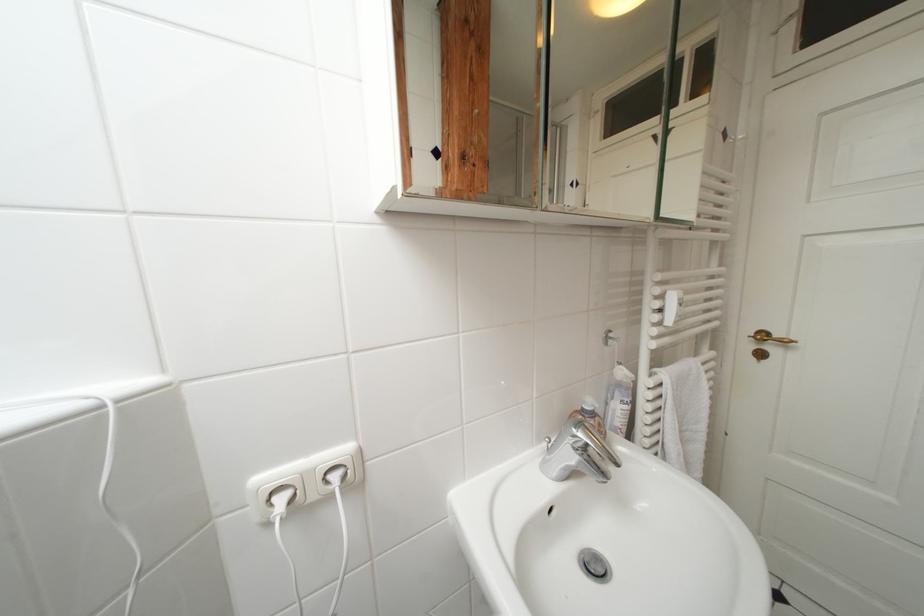
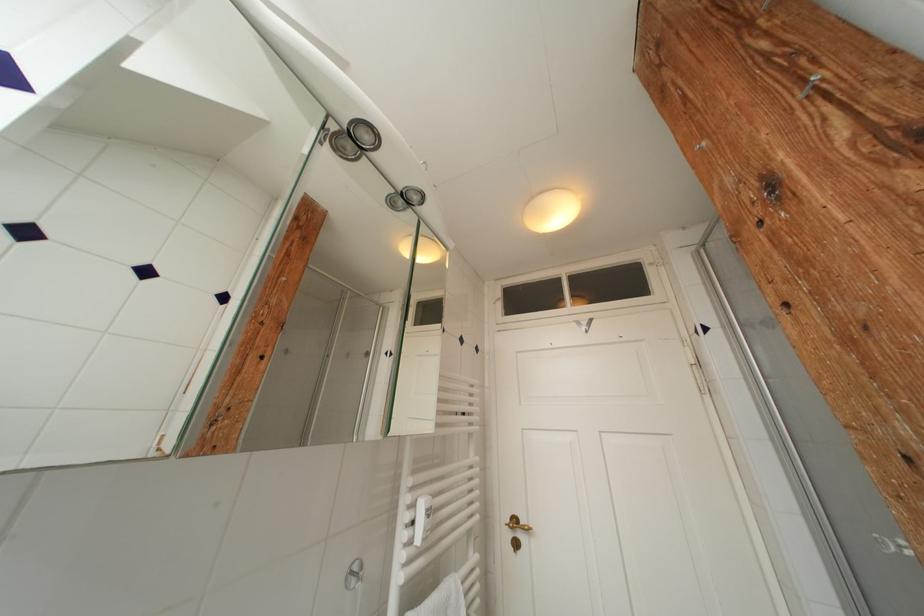
Based on the continuous images, in which direction is the camera rotating?

The rotation direction of the camera is right-up.